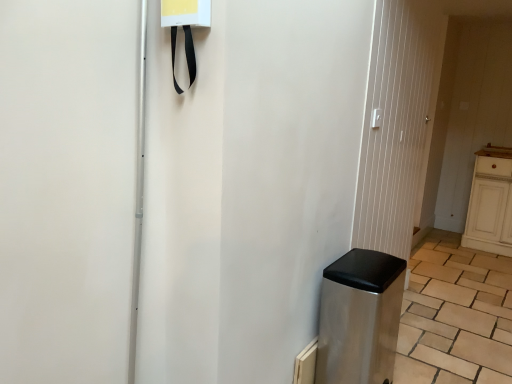
The width and height of the screenshot is (512, 384). Describe the element at coordinates (360, 318) in the screenshot. I see `stainless steel trash can at lower right` at that location.

This screenshot has width=512, height=384. What do you see at coordinates (495, 151) in the screenshot?
I see `brown wooden counter top at right` at bounding box center [495, 151].

Locate an element on the screen. This screenshot has width=512, height=384. metallic silver screen door at center is located at coordinates (397, 123).

From a real-world perspective, is brown wooden counter top at right below metallic silver screen door at center?

Yes, from a real-world perspective, brown wooden counter top at right is below metallic silver screen door at center.

Is brown wooden counter top at right smaller than metallic silver screen door at center?

Indeed, brown wooden counter top at right has a smaller size compared to metallic silver screen door at center.

In the scene shown: Between metallic silver screen door at center and stainless steel trash can at lower right, which one appears on the right side from the viewer's perspective?

Positioned to the right is metallic silver screen door at center.

Locate an element on the screen. This screenshot has height=384, width=512. appliance located on the left of metallic silver screen door at center is located at coordinates (360, 318).

Is there a large distance between metallic silver screen door at center and stainless steel trash can at lower right?

No.

Could brown wooden counter top at right be considered to be inside stainless steel trash can at lower right?

Definitely not — brown wooden counter top at right is not inside stainless steel trash can at lower right.

From the image's perspective, does stainless steel trash can at lower right appear higher than brown wooden counter top at right?

No, from the image's perspective, stainless steel trash can at lower right is not over brown wooden counter top at right.

Does stainless steel trash can at lower right have a lesser width compared to brown wooden counter top at right?

Incorrect, the width of stainless steel trash can at lower right is not less than that of brown wooden counter top at right.

From a real-world perspective, which object rests below the other?

stainless steel trash can at lower right.

Is brown wooden counter top at right turned away from stainless steel trash can at lower right?

No.

How many degrees apart are the facing directions of brown wooden counter top at right and stainless steel trash can at lower right?

The facing directions of brown wooden counter top at right and stainless steel trash can at lower right are 92.7 degrees apart.

Which point is more distant from viewer, (483, 155) or (382, 292)?

The point (483, 155) is behind.

Would you consider brown wooden counter top at right to be distant from stainless steel trash can at lower right?

Absolutely, brown wooden counter top at right is distant from stainless steel trash can at lower right.

From a real-world perspective, which is physically below, metallic silver screen door at center or brown wooden counter top at right?

brown wooden counter top at right.

From the image's perspective, is metallic silver screen door at center under brown wooden counter top at right?

Yes, from the image's perspective, metallic silver screen door at center is beneath brown wooden counter top at right.

Can you see metallic silver screen door at center touching brown wooden counter top at right?

There is a gap between metallic silver screen door at center and brown wooden counter top at right.

In the image, is stainless steel trash can at lower right on the left side or the right side of metallic silver screen door at center?

Based on their positions, stainless steel trash can at lower right is located to the left of metallic silver screen door at center.

Is there a large distance between stainless steel trash can at lower right and metallic silver screen door at center?

No.

Based on the photo, does stainless steel trash can at lower right come behind metallic silver screen door at center?

No, stainless steel trash can at lower right is closer to the camera.

Locate an element on the screen. The width and height of the screenshot is (512, 384). counter top that is under the metallic silver screen door at center (from a real-world perspective) is located at coordinates (495, 151).

In order to click on appliance in front of the metallic silver screen door at center in this screenshot , I will do `click(360, 318)`.

Which object lies nearer to the anchor point brown wooden counter top at right, stainless steel trash can at lower right or metallic silver screen door at center?

metallic silver screen door at center is positioned closer to the anchor brown wooden counter top at right.

Which object lies further to the anchor point brown wooden counter top at right, metallic silver screen door at center or stainless steel trash can at lower right?

stainless steel trash can at lower right lies further to brown wooden counter top at right than the other object.

Based on their spatial positions, is brown wooden counter top at right or stainless steel trash can at lower right further from metallic silver screen door at center?

brown wooden counter top at right.

In the scene shown: Estimate the real-world distances between objects in this image. Which object is closer to stainless steel trash can at lower right, metallic silver screen door at center or brown wooden counter top at right?

metallic silver screen door at center is positioned closer to the anchor stainless steel trash can at lower right.

Looking at the image, which one is located further to metallic silver screen door at center, stainless steel trash can at lower right or brown wooden counter top at right?

brown wooden counter top at right is positioned further to the anchor metallic silver screen door at center.

Considering their positions, is brown wooden counter top at right positioned closer to stainless steel trash can at lower right than metallic silver screen door at center?

metallic silver screen door at center is positioned closer to the anchor stainless steel trash can at lower right.

I want to click on screen door between stainless steel trash can at lower right and brown wooden counter top at right along the z-axis, so click(397, 123).